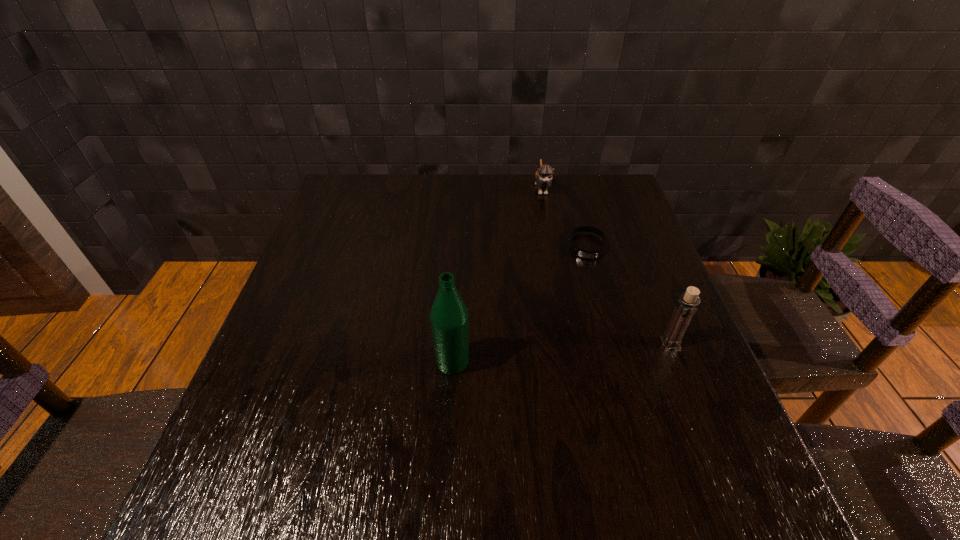
Identify the location of vacant space at the near edge of the desktop. This screenshot has height=540, width=960. (605, 437).

Find the location of a particular element. Image resolution: width=960 pixels, height=540 pixels. vacant space at the left edge of the desktop is located at coordinates (306, 258).

The height and width of the screenshot is (540, 960). Find the location of `vacant space at the right edge of the desktop`. vacant space at the right edge of the desktop is located at coordinates (591, 248).

In the image, there is a desktop. Find the location of `vacant space at the far left corner`. vacant space at the far left corner is located at coordinates (377, 183).

Find the location of a particular element. The height and width of the screenshot is (540, 960). free space between the shortest object and the candle holder is located at coordinates (629, 294).

This screenshot has width=960, height=540. Find the location of `free space between the kitten and the candle holder`. free space between the kitten and the candle holder is located at coordinates (606, 266).

I want to click on free space between the third object from left to right and the second tallest object, so click(x=629, y=294).

At what (x,y) coordinates should I click in order to perform the action: click on vacant space in between the third shortest object and the second object from left to right. Please return your answer as a coordinate pair (x, y). This screenshot has width=960, height=540. Looking at the image, I should click on (606, 266).

You are a GUI agent. You are given a task and a screenshot of the screen. Output one action in this format:
    pyautogui.click(x=<x>, y=<y>)
    Task: Click on the vacant area that lies between the second object from right to left and the second shortest object
    
    Given the screenshot: What is the action you would take?
    point(564,217)

Find the location of a particular element. The height and width of the screenshot is (540, 960). vacant space that is in between the candle holder and the second object from right to left is located at coordinates (629, 294).